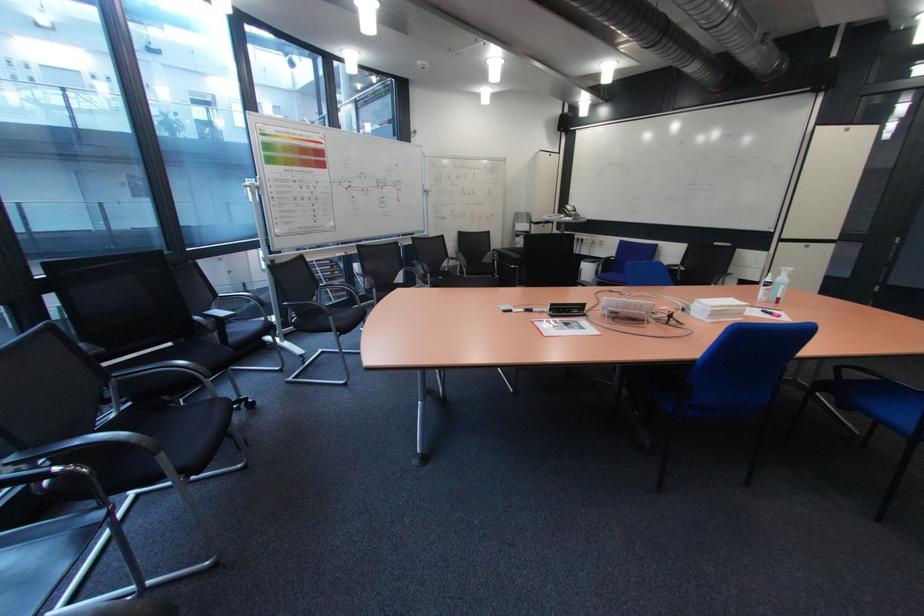
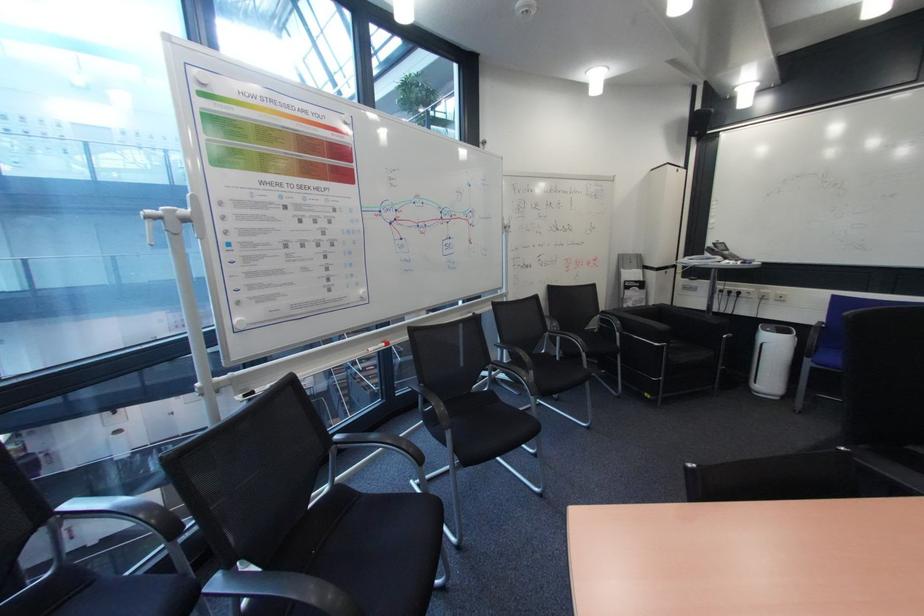
The images are taken continuously from a first-person perspective. In which direction are you moving?

The cameraman moved toward left, forward.